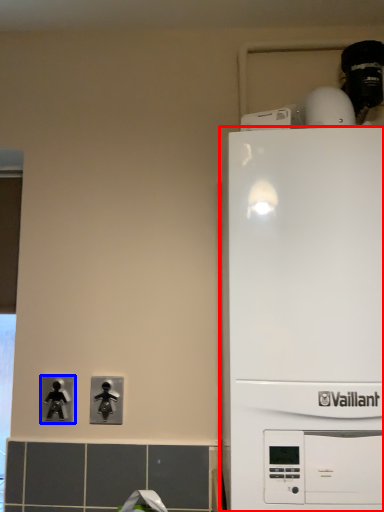
Question: Which object is closer to the camera taking this photo, home appliance (highlighted by a red box) or light switch (highlighted by a blue box)?

Choices:
 (A) home appliance
 (B) light switch

Answer: (A)